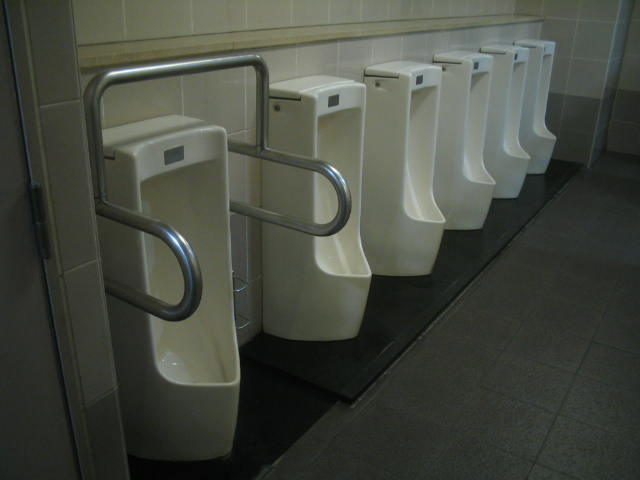
This screenshot has height=480, width=640. Identify the location of urinals. click(x=191, y=368), click(x=355, y=289), click(x=416, y=235), click(x=477, y=187), click(x=524, y=169), click(x=548, y=145).